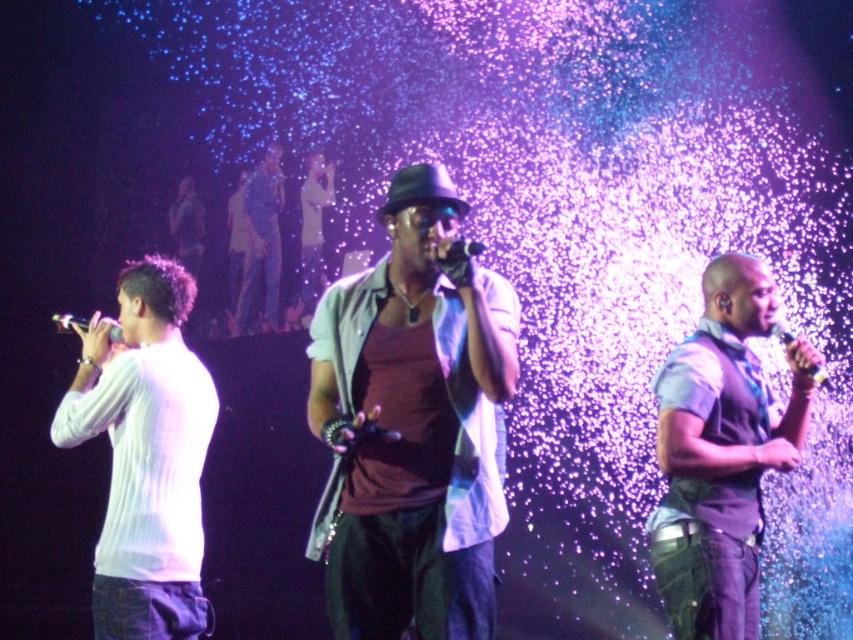
You are a stagehand who needs to adjust the microphones during a performance. The stage has a narrow walkway between the two microphones. If your body requires 3 feet of space to move comfortably, can you safely walk between the matte black microphone at left and the metallic silver microphone at right?

The distance between the matte black microphone at left and the metallic silver microphone at right is 9.97 feet. Since the stagehand needs 3 feet of space to move comfortably, there is sufficient space as 9.97 feet is greater than 3 feet.